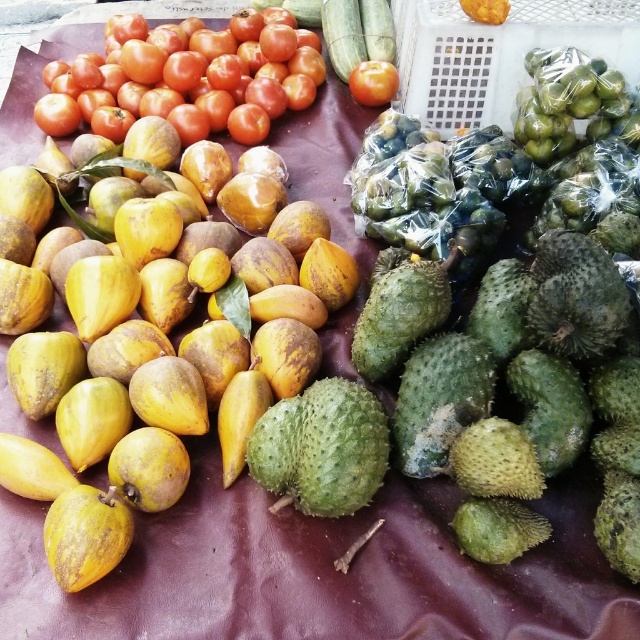
You are a grocery store employee who needs to place a 12 inch ruler between the yellow matte fruit at left and the shiny red tomato at upper center. Can you fit the ruler horizontally between them?

The distance between the yellow matte fruit at left and the shiny red tomato at upper center is 31.08 inches, which is more than enough to fit a 12 inch ruler horizontally between them.

Where are the shiny red tomatoes at upper left located in the image?

The shiny red tomatoes at upper left are located at point [184,72].